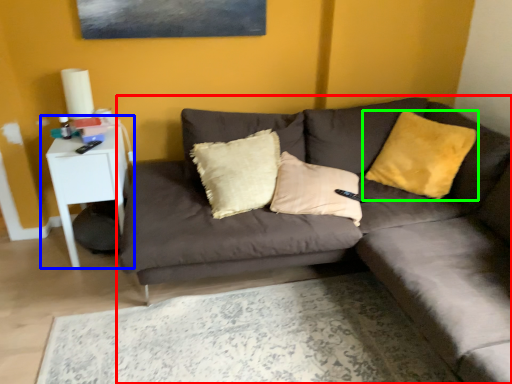
Question: Based on their relative distances, which object is farther from studio couch (highlighted by a red box)? Choose from table (highlighted by a blue box) and pillow (highlighted by a green box).

Choices:
 (A) table
 (B) pillow

Answer: (A)